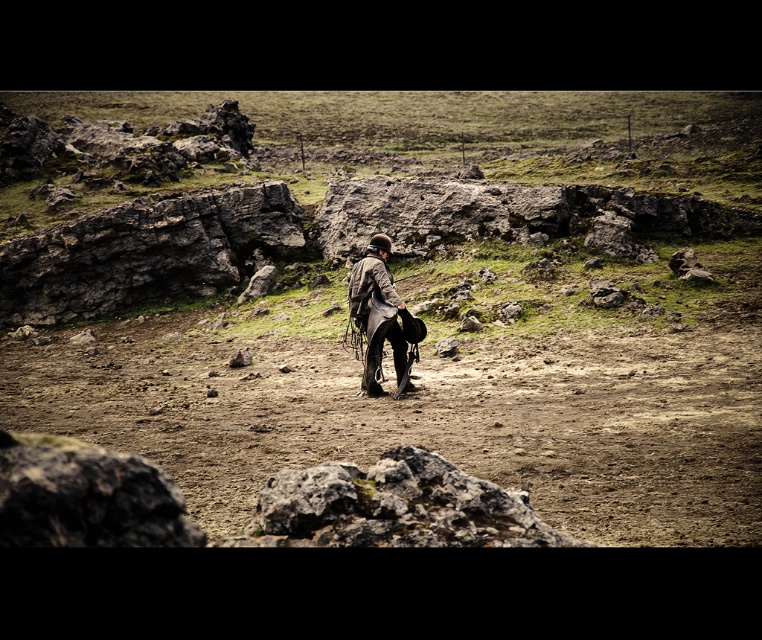
Is dull gray rock at center above leather jacket at center?

Yes, dull gray rock at center is above leather jacket at center.

Which is behind, point (501, 125) or point (395, 314)?

Positioned behind is point (501, 125).

Who is more distant from viewer, (514,188) or (395,296)?

The point (514,188) is behind.

Image resolution: width=762 pixels, height=640 pixels. What are the coordinates of `dull gray rock at center` in the screenshot? It's located at pos(338,180).